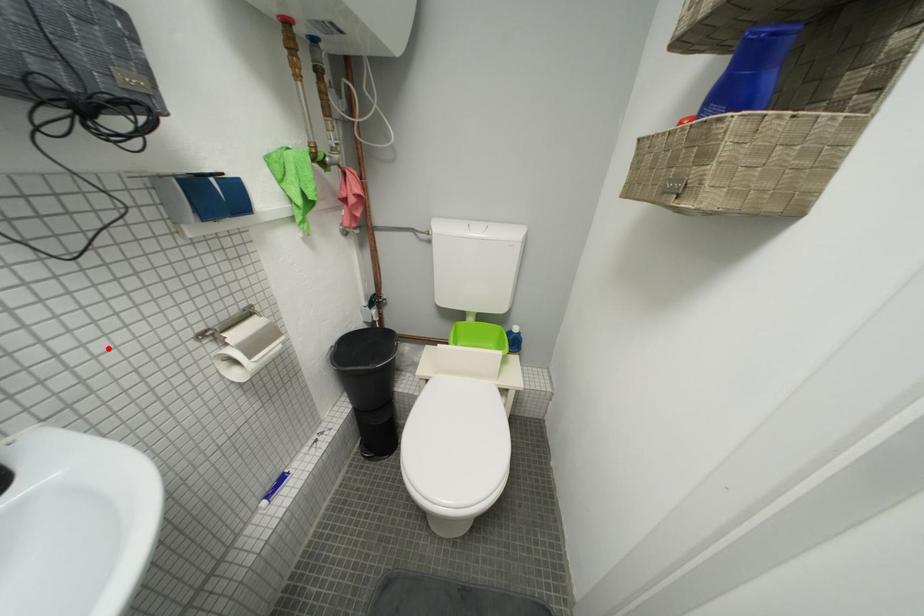
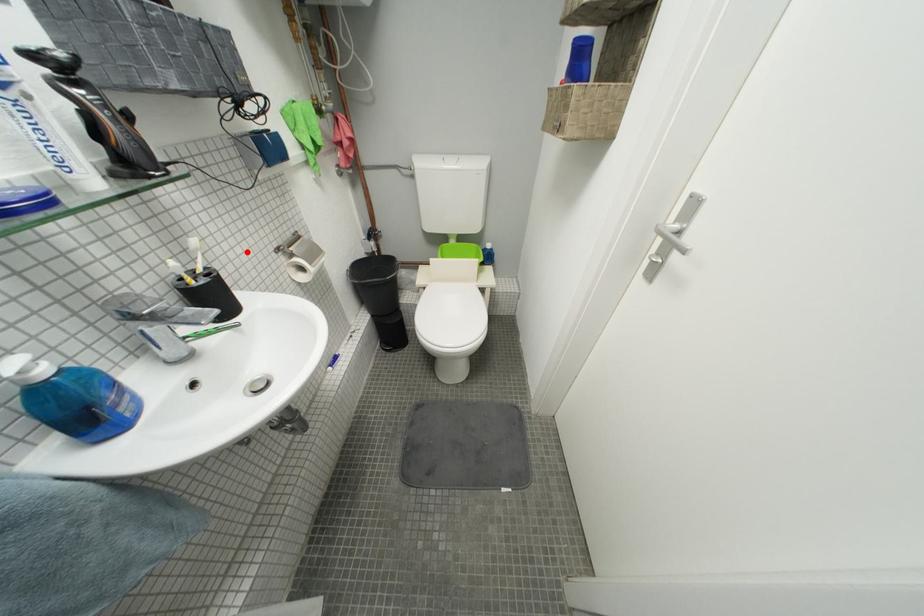
I am providing you with two images of the same scene from different viewpoints. A red point is marked on the first image and another point is marked on the second image. Do the highlighted points in image1 and image2 indicate the same real-world spot?

Yes